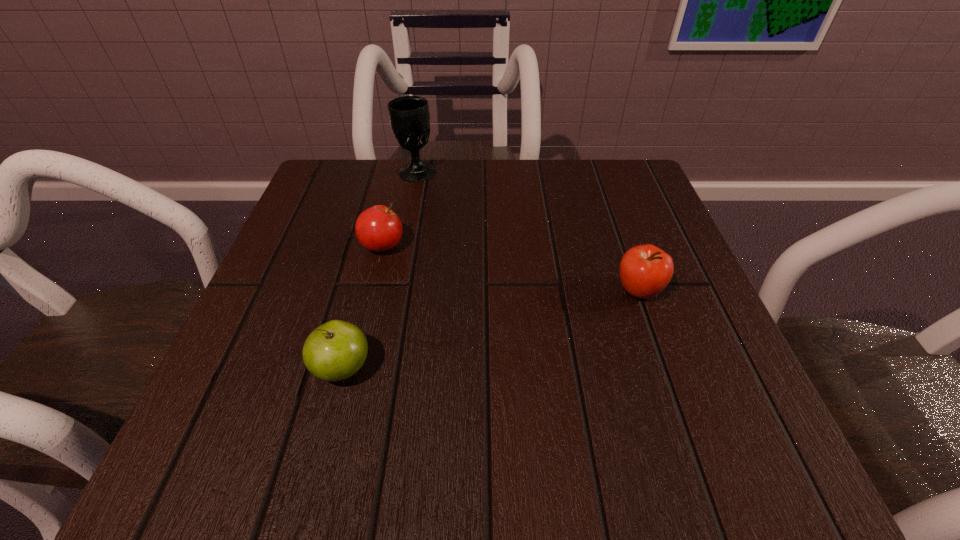
Image resolution: width=960 pixels, height=540 pixels. What are the coordinates of `vacant area located on the right of the farthest apple` in the screenshot? It's located at (458, 246).

Image resolution: width=960 pixels, height=540 pixels. I want to click on object present at the far edge, so click(409, 116).

Find the location of a particular element. object at the right edge is located at coordinates 645,270.

The width and height of the screenshot is (960, 540). In the image, there is a desktop. What are the coordinates of `vacant space at the far edge` in the screenshot? It's located at pyautogui.click(x=403, y=164).

Locate an element on the screen. Image resolution: width=960 pixels, height=540 pixels. vacant space at the near edge of the desktop is located at coordinates 426,472.

Where is `free space at the left edge of the desktop`? free space at the left edge of the desktop is located at coordinates (327, 253).

Locate an element on the screen. vacant space at the right edge of the desktop is located at coordinates (629, 240).

Locate an element on the screen. This screenshot has height=540, width=960. vacant space at the near left corner of the desktop is located at coordinates (300, 442).

The image size is (960, 540). Find the location of `free space at the far right corner`. free space at the far right corner is located at coordinates (598, 208).

At what (x,y) coordinates should I click in order to perform the action: click on vacant region at the near right corner of the desktop. Please return your answer as a coordinate pair (x, y). The width and height of the screenshot is (960, 540). Looking at the image, I should click on 655,427.